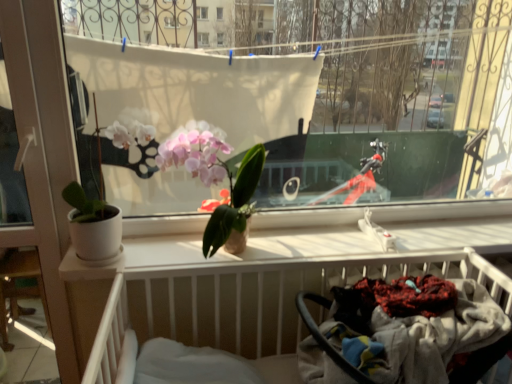
Question: In the image, is black rubber baby carriage at lower right on the left side or the right side of pink matte orchid at center?

Choices:
 (A) right
 (B) left

Answer: (A)

Question: Relative to pink matte orchid at center, is black rubber baby carriage at lower right in front or behind?

Choices:
 (A) behind
 (B) front

Answer: (B)

Question: Based on their relative distances, which object is farther from the white plastic hospital bed at lower center?

Choices:
 (A) pink matte orchid at center
 (B) white plastic screen door at left
 (C) black rubber baby carriage at lower right

Answer: (B)

Question: Considering the real-world distances, which object is closest to the white plastic hospital bed at lower center?

Choices:
 (A) black rubber baby carriage at lower right
 (B) white plastic screen door at left
 (C) pink matte orchid at center

Answer: (A)